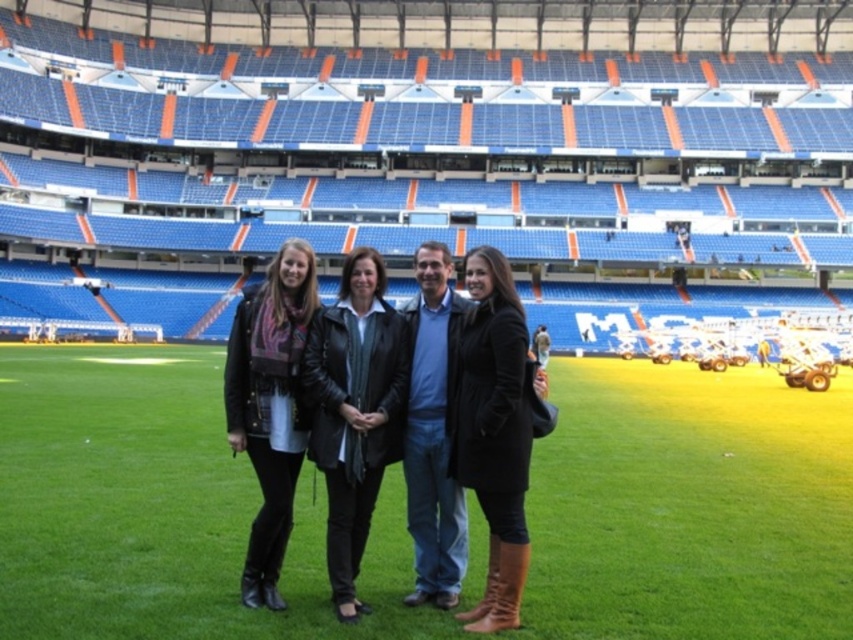
You are standing at the origin point of the coordinate system in the image. A drone is flying towards the green grass at center. What are the coordinates where the drone will land?

The coordinates where the drone will land are at point (689, 506).

You are standing at the point labeled point (x=312, y=388) and want to walk to the point labeled point (x=280, y=246). Given that both points are on the same grassy field, which direction should you move in to get closer to your destination?

To move from point (x=312, y=388) to point (x=280, y=246), you should move towards the direction away from the camera since point (x=280, y=246) is farther from the camera compared to your current position at point (x=312, y=388).

You are standing at the origin point of the coordinate system in the stadium field. The black leather jacket at center is located at point (354,412). If you want to walk directly to the black leather jacket at center, in which direction should you move?

The point (354,412) is located at the center of the stadium field, so you should move towards the center to reach the black leather jacket at center.